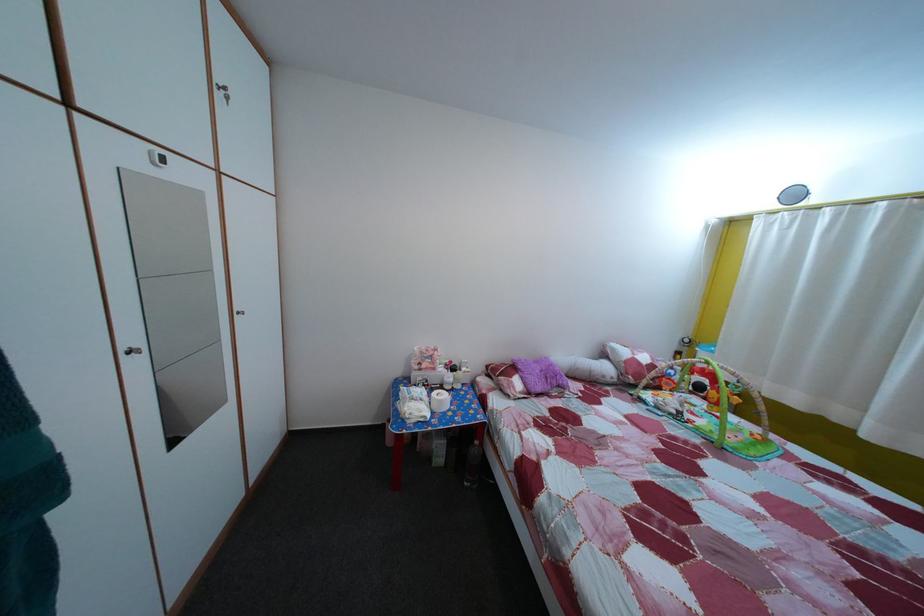
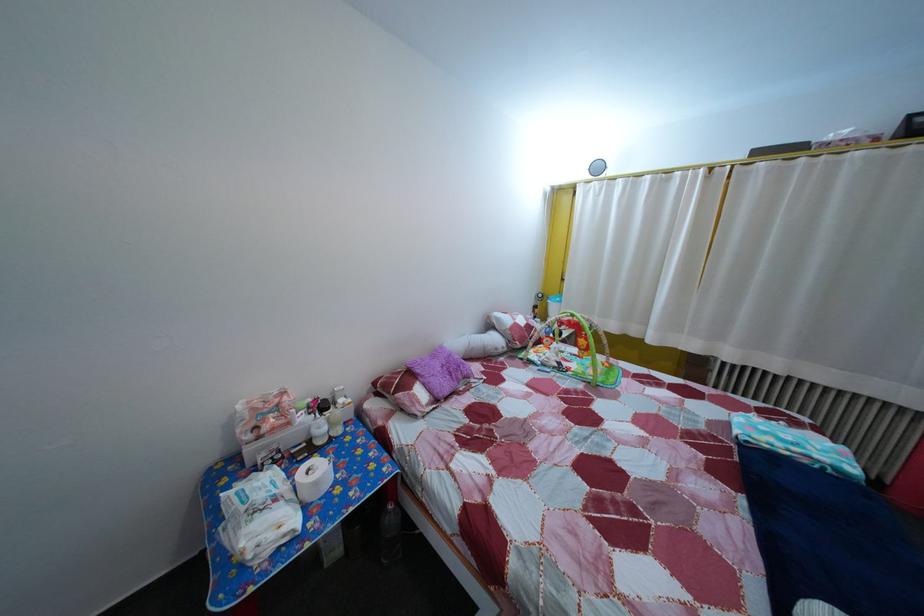
In the second image, find the point that corresponds to [485,450] in the first image.

(399, 515)